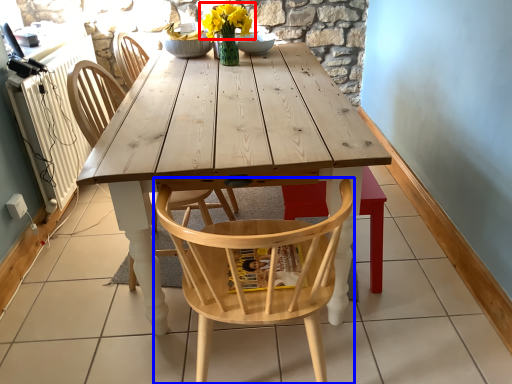
Question: Which object is closer to the camera taking this photo, flower (highlighted by a red box) or chair (highlighted by a blue box)?

Choices:
 (A) flower
 (B) chair

Answer: (B)